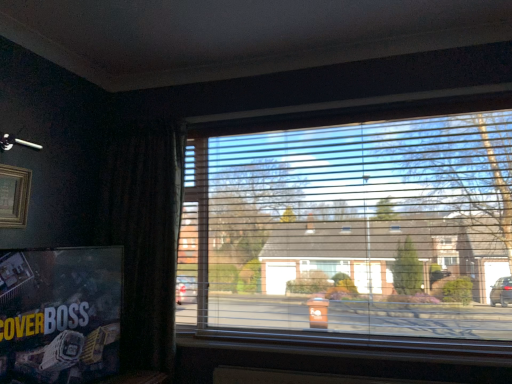
Question: Can you confirm if matte black poster at lower left is bigger than transparent plastic blinds at center?

Choices:
 (A) no
 (B) yes

Answer: (A)

Question: Considering the relative sizes of matte black poster at lower left and transparent plastic blinds at center in the image provided, is matte black poster at lower left wider than transparent plastic blinds at center?

Choices:
 (A) no
 (B) yes

Answer: (A)

Question: Can you confirm if matte black poster at lower left is thinner than transparent plastic blinds at center?

Choices:
 (A) no
 (B) yes

Answer: (B)

Question: Can transparent plastic blinds at center be found inside matte black poster at lower left?

Choices:
 (A) no
 (B) yes

Answer: (A)

Question: Is matte black poster at lower left facing towards transparent plastic blinds at center?

Choices:
 (A) no
 (B) yes

Answer: (A)

Question: Considering their positions, is matte black poster at lower left located in front of or behind wooden at lower center?

Choices:
 (A) behind
 (B) front

Answer: (B)

Question: Considering the positions of point (82, 336) and point (202, 332), is point (82, 336) closer or farther from the camera than point (202, 332)?

Choices:
 (A) closer
 (B) farther

Answer: (A)

Question: Is matte black poster at lower left to the left or to the right of wooden at lower center in the image?

Choices:
 (A) left
 (B) right

Answer: (A)

Question: From their relative heights in the image, would you say matte black poster at lower left is taller or shorter than wooden at lower center?

Choices:
 (A) tall
 (B) short

Answer: (A)

Question: Visually, is wooden picture frame at upper left positioned to the left or to the right of wooden at lower center?

Choices:
 (A) left
 (B) right

Answer: (A)

Question: Is wooden picture frame at upper left inside the boundaries of wooden at lower center, or outside?

Choices:
 (A) inside
 (B) outside

Answer: (B)

Question: From a real-world perspective, is wooden picture frame at upper left positioned above or below wooden at lower center?

Choices:
 (A) above
 (B) below

Answer: (A)

Question: In terms of height, does wooden picture frame at upper left look taller or shorter compared to wooden at lower center?

Choices:
 (A) short
 (B) tall

Answer: (B)

Question: From a real-world perspective, is dark fabric curtain at left physically located above or below transparent plastic blinds at center?

Choices:
 (A) below
 (B) above

Answer: (A)

Question: Based on their sizes in the image, would you say dark fabric curtain at left is bigger or smaller than transparent plastic blinds at center?

Choices:
 (A) big
 (B) small

Answer: (B)